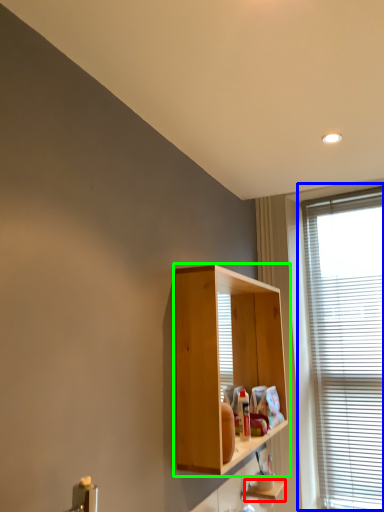
Question: Which object is positioned farthest from shelf (highlighted by a red box)? Select from window (highlighted by a blue box) and cabinetry (highlighted by a green box).

Choices:
 (A) window
 (B) cabinetry

Answer: (A)